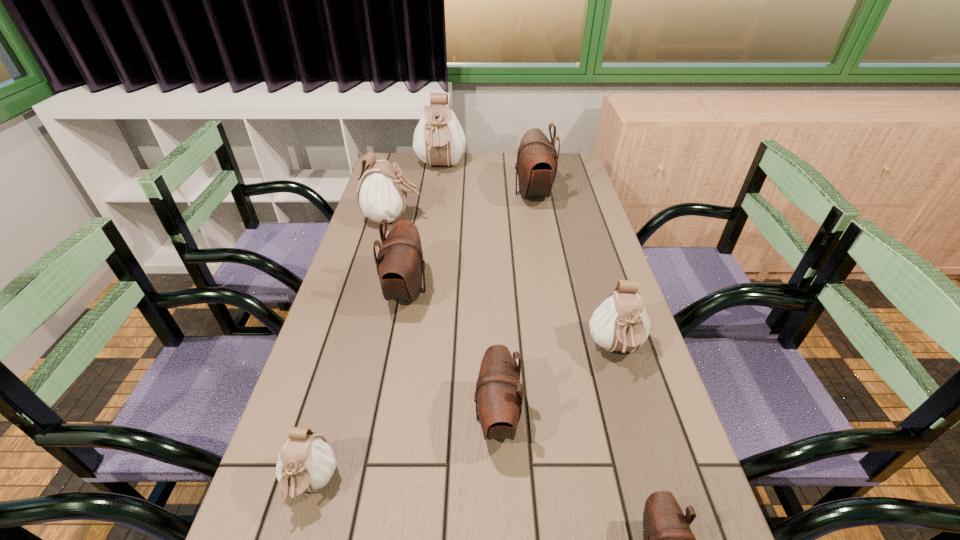
Find the location of `vacant space located 0.260m on the front-facing side of the biggest white pouch`. vacant space located 0.260m on the front-facing side of the biggest white pouch is located at coordinates (433, 221).

At what (x,y) coordinates should I click in order to perform the action: click on free location located with the flap open on the farthest brown pouch. Please return your answer as a coordinate pair (x, y). The image size is (960, 540). Looking at the image, I should click on (489, 194).

You are a GUI agent. You are given a task and a screenshot of the screen. Output one action in this format:
    pyautogui.click(x=<x>, y=<y>)
    Task: Click on the free region located 0.150m with the flap open on the farthest brown pouch
    Image resolution: width=960 pixels, height=540 pixels.
    Given the screenshot: What is the action you would take?
    pyautogui.click(x=472, y=194)

Identify the location of free space located with the flap open on the farthest brown pouch. pos(472,194).

Where is `vacant region located 0.340m on the front-facing side of the second biggest white pouch`? vacant region located 0.340m on the front-facing side of the second biggest white pouch is located at coordinates (524, 219).

The image size is (960, 540). In order to click on free space located with the flap open on the fourth farthest object in this screenshot , I will do `click(482, 291)`.

This screenshot has width=960, height=540. Identify the location of free region located on the front-facing side of the third biggest white pouch. point(634,408).

The height and width of the screenshot is (540, 960). Identify the location of free space located 0.310m with the flap open on the third brown pouch from right to left. (325, 418).

In order to click on vacant area located 0.240m with the flap open on the third brown pouch from right to left in this screenshot , I will do `click(359, 418)`.

Where is `vacant space located with the flap open on the third brown pouch from right to left`? The width and height of the screenshot is (960, 540). vacant space located with the flap open on the third brown pouch from right to left is located at coordinates (311, 418).